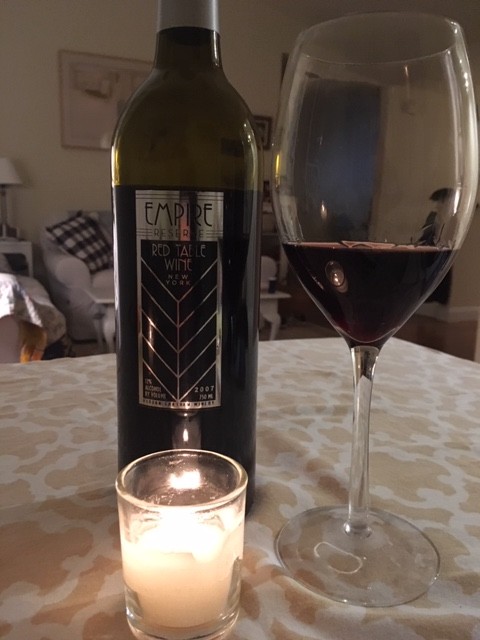
You are a GUI agent. You are given a task and a screenshot of the screen. Output one action in this format:
    pyautogui.click(x=<x>, y=<y>)
    Task: Click on the couch
    The image size is (480, 640).
    Given the screenshot: What is the action you would take?
    pyautogui.click(x=85, y=282)